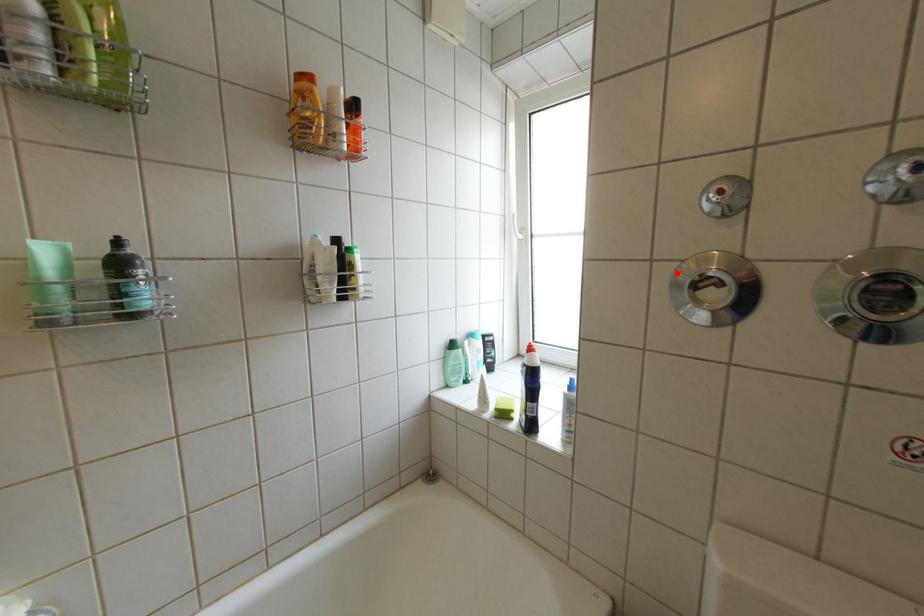
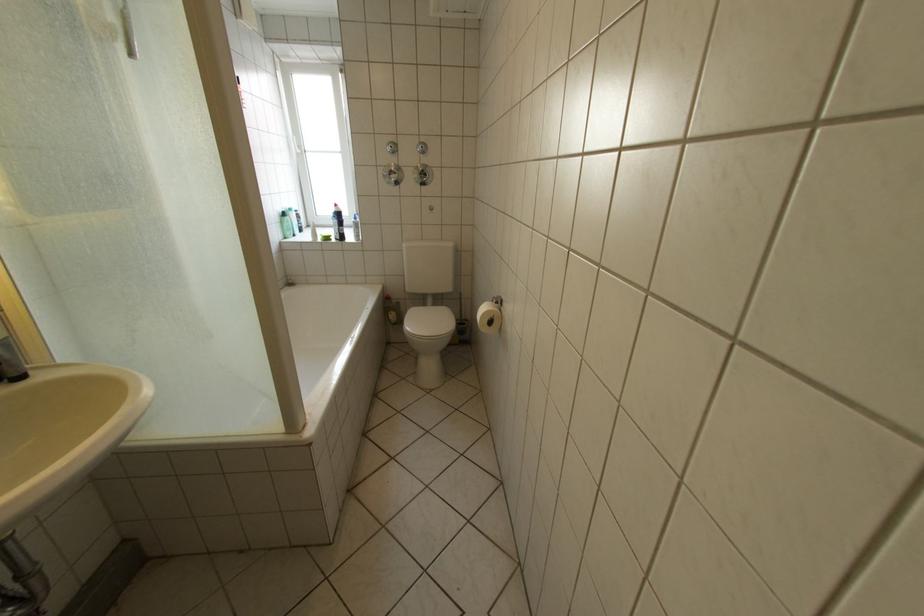
Locate, in the second image, the point that corresponds to the highlighted location in the first image.

(393, 171)